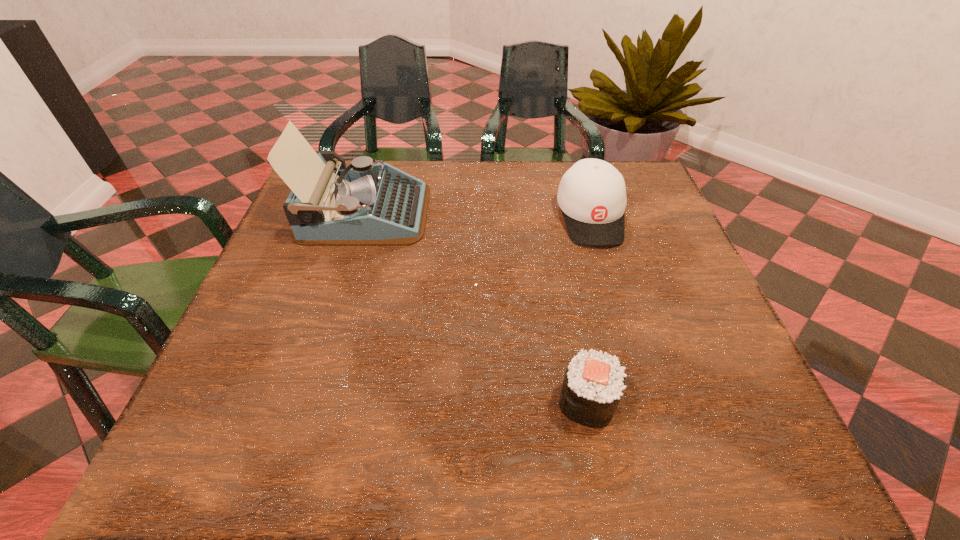
The width and height of the screenshot is (960, 540). Find the location of `object that is the nearest to the nearest object`. object that is the nearest to the nearest object is located at coordinates (592, 194).

At what (x,y) coordinates should I click in order to perform the action: click on the second closest object relative to the baseball cap. Please return your answer as a coordinate pair (x, y). This screenshot has width=960, height=540. Looking at the image, I should click on (593, 384).

Identify the location of vacant area that satisfies the following two spatial constraints: 1. on the typing side of the tallest object; 2. on the back side of the shortest object. (306, 402).

Locate an element on the screen. This screenshot has height=540, width=960. vacant space that satisfies the following two spatial constraints: 1. on the typing side of the sushi; 2. on the left side of the typewriter is located at coordinates (306, 402).

Identify the location of free space that satisfies the following two spatial constraints: 1. on the typing side of the leftmost object; 2. on the back side of the sushi. The width and height of the screenshot is (960, 540). (306, 402).

You are a GUI agent. You are given a task and a screenshot of the screen. Output one action in this format:
    pyautogui.click(x=<x>, y=<y>)
    Task: Click on the vacant space that satisfies the following two spatial constraints: 1. on the typing side of the leftmost object; 2. on the left side of the sushi
    
    Given the screenshot: What is the action you would take?
    pyautogui.click(x=306, y=402)

The image size is (960, 540). I want to click on free space that satisfies the following two spatial constraints: 1. on the typing side of the leftmost object; 2. on the right side of the shortest object, so click(306, 402).